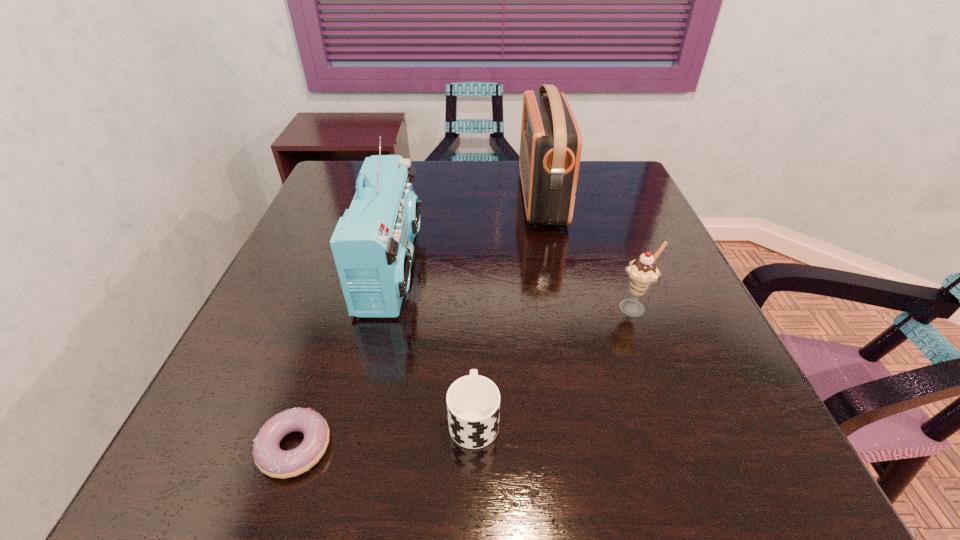
Locate an element on the screen. object situated at the right edge is located at coordinates (642, 272).

In order to click on object that is at the near left corner in this screenshot , I will do `click(271, 460)`.

Where is `vacant region at the far edge`? The image size is (960, 540). vacant region at the far edge is located at coordinates point(504,174).

You are a GUI agent. You are given a task and a screenshot of the screen. Output one action in this format:
    pyautogui.click(x=<x>, y=<y>)
    Task: Click on the free spot at the near edge of the desktop
    
    Given the screenshot: What is the action you would take?
    pyautogui.click(x=573, y=483)

The width and height of the screenshot is (960, 540). I want to click on vacant area at the left edge of the desktop, so tap(329, 227).

This screenshot has height=540, width=960. I want to click on vacant space at the right edge, so click(689, 333).

Find the location of a particular element. free location at the far left corner is located at coordinates (323, 185).

Locate an element on the screen. The image size is (960, 540). empty location between the fourth tallest object and the rightmost object is located at coordinates (554, 363).

Image resolution: width=960 pixels, height=540 pixels. I want to click on free spot between the fourth object from left to right and the fourth tallest object, so click(x=508, y=308).

Where is `empty location between the fourth object from left to right and the doughnut`? The image size is (960, 540). empty location between the fourth object from left to right and the doughnut is located at coordinates (419, 322).